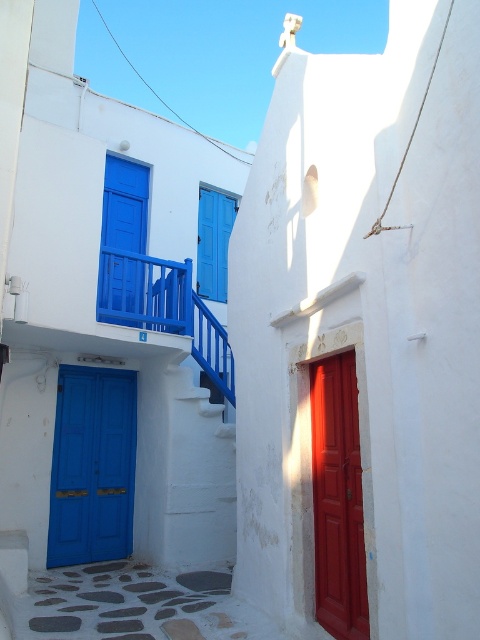
Question: Which point appears closest to the camera in this image?

Choices:
 (A) (69, 429)
 (B) (342, 420)

Answer: (B)

Question: Does blue painted wood at upper left appear on the right side of white painted wood stairs at center?

Choices:
 (A) yes
 (B) no

Answer: (B)

Question: Is matte blue door at left closer to camera compared to blue painted wood shutter at center?

Choices:
 (A) yes
 (B) no

Answer: (A)

Question: Which point appears farthest from the camera in this image?

Choices:
 (A) (232, 202)
 (B) (330, 524)

Answer: (A)

Question: Is smooth glossy wood door at right to the left of matte blue door at center from the viewer's perspective?

Choices:
 (A) yes
 (B) no

Answer: (B)

Question: Which of the following is the farthest from the observer?

Choices:
 (A) matte blue door at center
 (B) white painted wood stairs at center

Answer: (B)